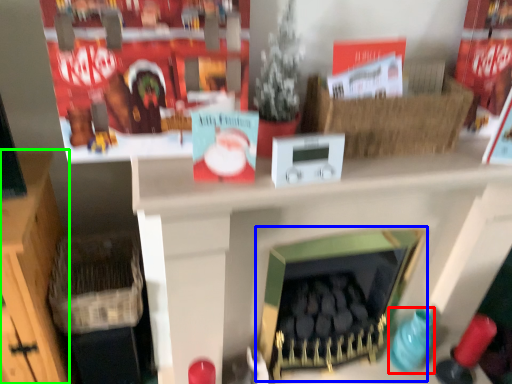
Question: Estimate the real-world distances between objects in this image. Which object is farther from toy (highlighted by a red box), fireplace (highlighted by a blue box) or furniture (highlighted by a green box)?

Choices:
 (A) fireplace
 (B) furniture

Answer: (B)